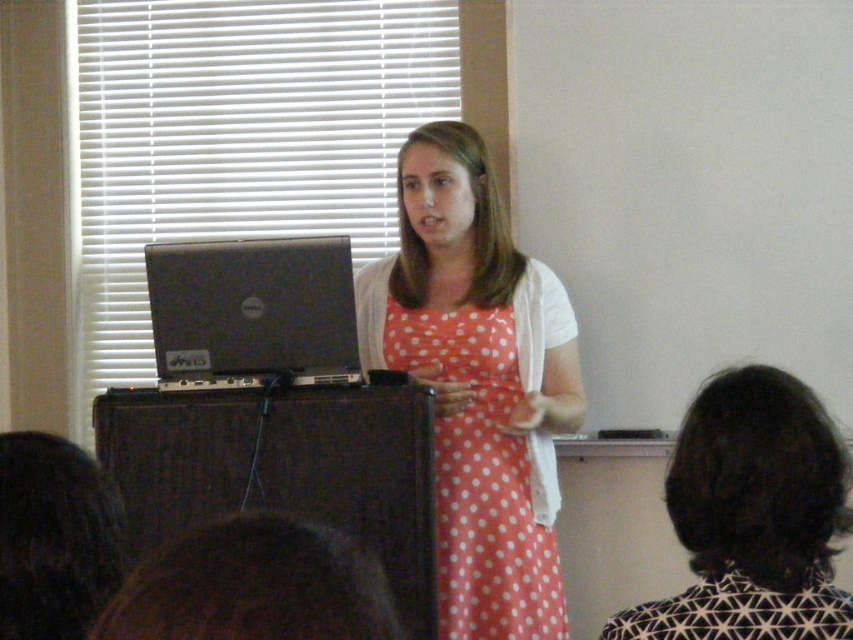
Is point (543, 525) positioned after point (169, 369)?

That is True.

Can you confirm if orange polka dot dress at center is thinner than silver metallic laptop at center?

No, orange polka dot dress at center is not thinner than silver metallic laptop at center.

The width and height of the screenshot is (853, 640). In order to click on orange polka dot dress at center in this screenshot , I will do `click(490, 460)`.

Between polka dot fabric dress at center and orange polka dot dress at center, which one appears on the left side from the viewer's perspective?

orange polka dot dress at center is more to the left.

Is polka dot fabric dress at center taller than orange polka dot dress at center?

Incorrect, polka dot fabric dress at center's height is not larger of orange polka dot dress at center's.

Locate an element on the screen. polka dot fabric dress at center is located at coordinates [753, 516].

In order to click on polka dot fabric dress at center in this screenshot , I will do [753, 516].

Does polka dot fabric dress at center appear on the right side of silver metallic laptop at center?

Indeed, polka dot fabric dress at center is positioned on the right side of silver metallic laptop at center.

Is polka dot fabric dress at center thinner than silver metallic laptop at center?

Correct, polka dot fabric dress at center's width is less than silver metallic laptop at center's.

Image resolution: width=853 pixels, height=640 pixels. What do you see at coordinates (753, 516) in the screenshot?
I see `polka dot fabric dress at center` at bounding box center [753, 516].

The height and width of the screenshot is (640, 853). Find the location of `polka dot fabric dress at center`. polka dot fabric dress at center is located at coordinates (753, 516).